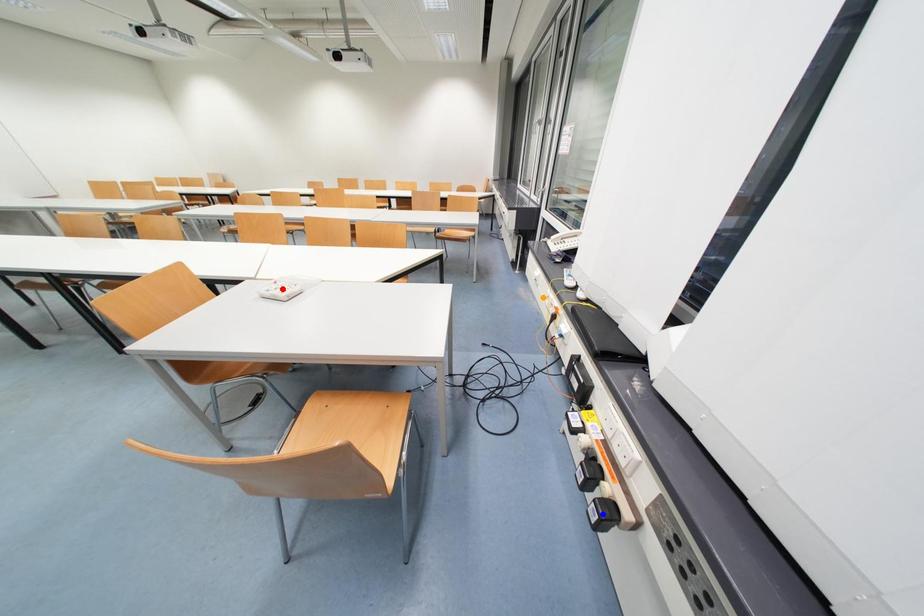
Order these from nearest to farthest:
- blue point
- red point
- orange point

blue point
red point
orange point